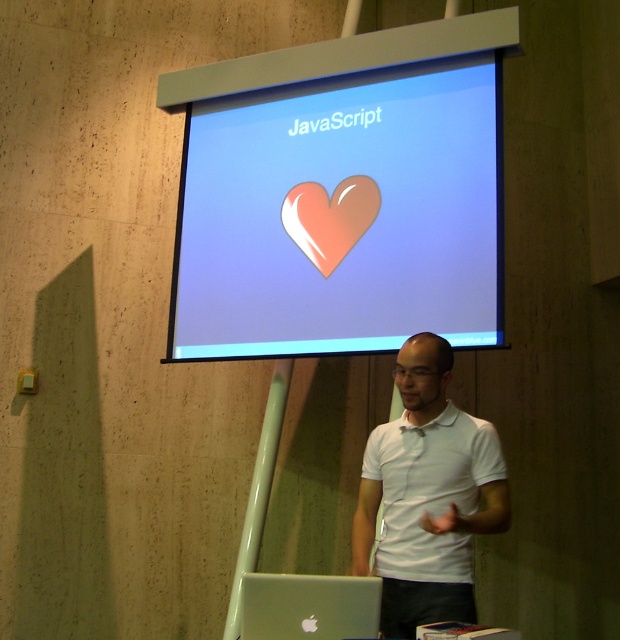
Question: Is white matte shirt at center thinner than silver metallic laptop at lower center?

Choices:
 (A) yes
 (B) no

Answer: (B)

Question: Which of these objects is positioned farthest from the matte plastic heart at upper center?

Choices:
 (A) silver metallic laptop at lower center
 (B) white matte shirt at center

Answer: (A)

Question: Which point appears farthest from the camera in this image?

Choices:
 (A) (308, 595)
 (B) (454, 563)

Answer: (B)

Question: Can you confirm if white matte shirt at center is bigger than silver metallic laptop at lower center?

Choices:
 (A) yes
 (B) no

Answer: (A)

Question: Can you confirm if matte plastic heart at upper center is smaller than glossy pink heart at center?

Choices:
 (A) yes
 (B) no

Answer: (B)

Question: Among these objects, which one is nearest to the camera?

Choices:
 (A) white matte shirt at center
 (B) silver metallic laptop at lower center
 (C) matte plastic heart at upper center

Answer: (B)